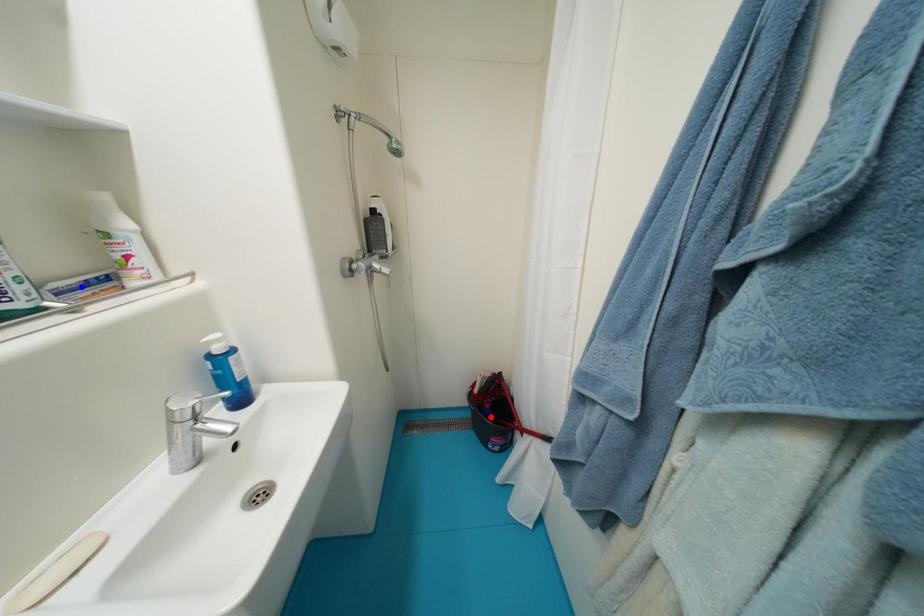
Question: In the image, two points are highlighted. Which point is nearer to the camera? Reply with the corresponding letter.

Choices:
 (A) blue point
 (B) red point

Answer: (A)